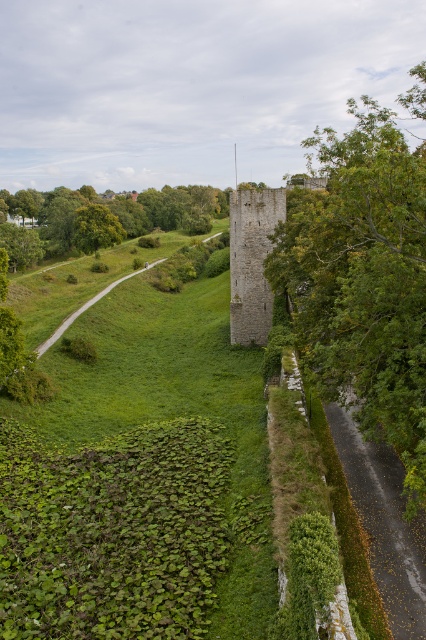
Between green leafy grass at center and green leafy tree at right, which one has more height?

With more height is green leafy tree at right.

Is point (204, 541) farther from viewer compared to point (411, 467)?

Yes.

Find the location of a particular element. The image size is (426, 640). green leafy grass at center is located at coordinates (140, 480).

Who is positioned more to the right, green leafy grass at center or green leafy tree at lower left?

Positioned to the right is green leafy grass at center.

Can you confirm if green leafy grass at center is bigger than green leafy tree at lower left?

No.

Find the location of a particular element. Image resolution: width=426 pixels, height=640 pixels. green leafy grass at center is located at coordinates (140, 480).

Is point (336, 392) farther from camera compared to point (181, 198)?

No, (336, 392) is in front of (181, 198).

Can you confirm if green leafy tree at right is bigger than green leafy tree at lower left?

Yes, green leafy tree at right is bigger than green leafy tree at lower left.

The height and width of the screenshot is (640, 426). In order to click on green leafy tree at right in this screenshot , I will do `click(363, 280)`.